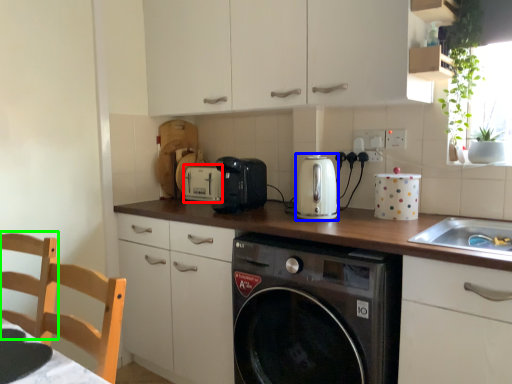
Question: Which object is positioned closest to appliance (highlighted by a red box)? Select from kitchen appliance (highlighted by a blue box) and chair (highlighted by a green box).

Choices:
 (A) kitchen appliance
 (B) chair

Answer: (A)